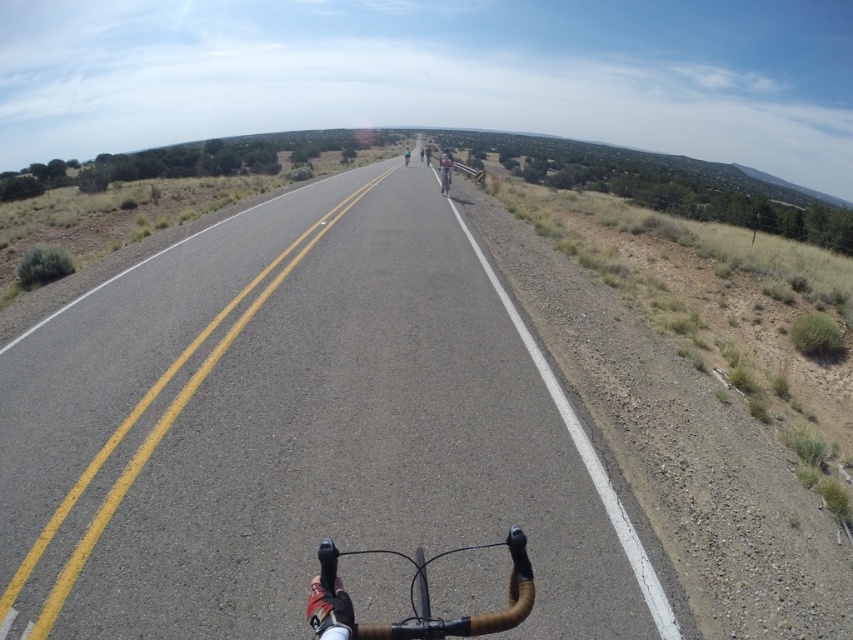
You are a cyclist riding on the road and see two points marked on the road ahead of you. The first point is at coordinate point (424, 605) and the second point is at coordinate point (426, 145). Which point will you reach first while continuing straight?

Point (424, 605) is closer to the viewer than point (426, 145), so you will reach point (424, 605) first.

In the scene shown: You are a cyclist riding on a rural road. You notice a shiny silver bicycle at center and a dark blue jersey at center ahead of you. Which object will appear closer to you as you continue riding forward?

The shiny silver bicycle at center will appear closer because it is shorter than the dark blue jersey at center, meaning it is physically closer to your position.